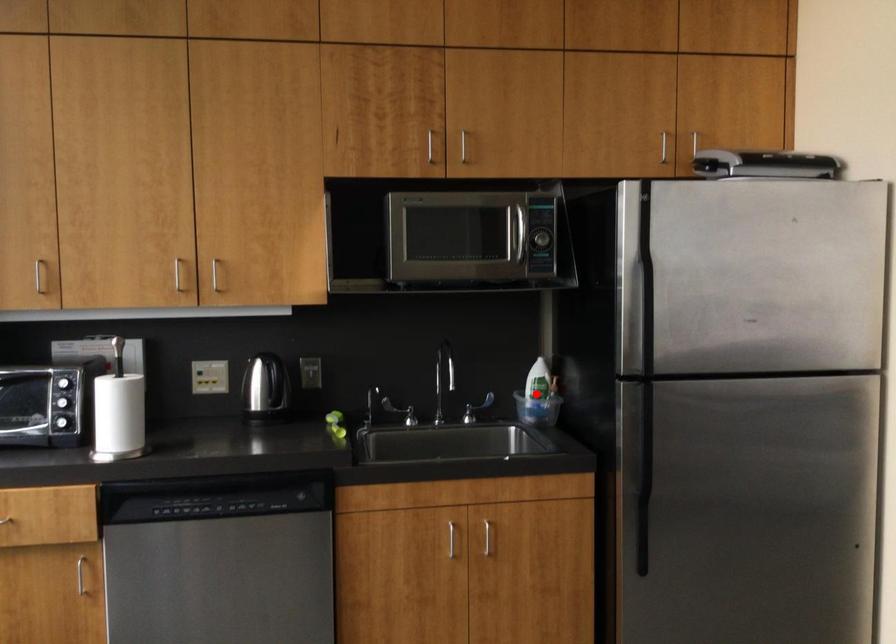
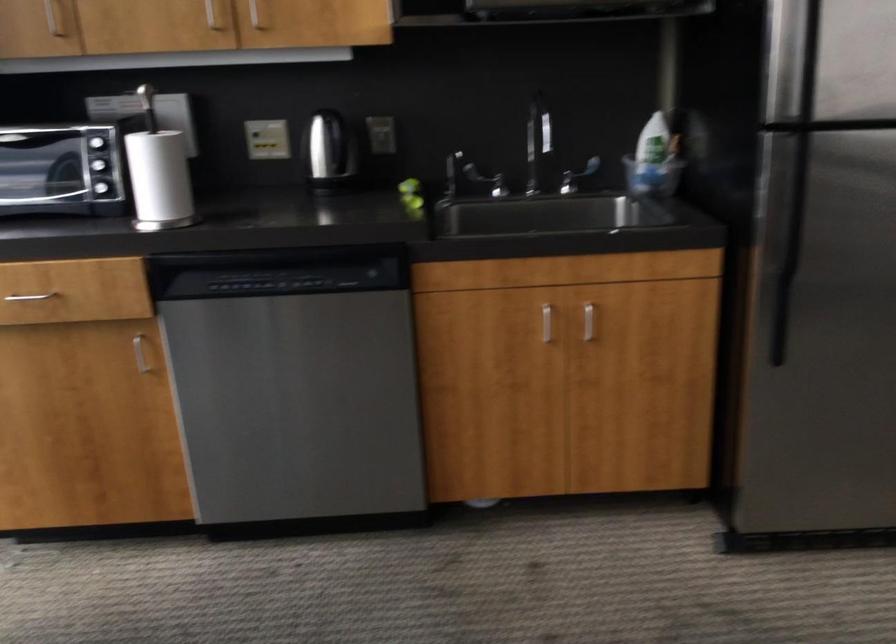
Find the pixel in the second image that matches the highlighted location in the first image.

(650, 155)